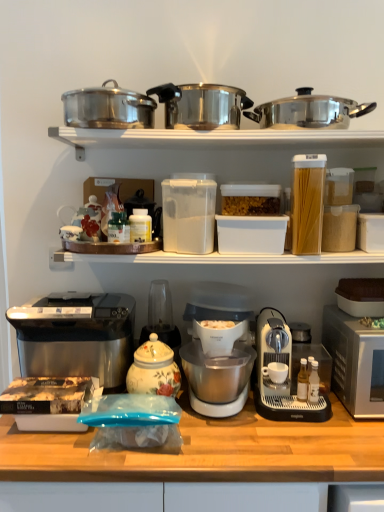
Where is `free space in front of white plastic coffee maker at center, arranged as the 2th coffee maker when viewed from the right`? free space in front of white plastic coffee maker at center, arranged as the 2th coffee maker when viewed from the right is located at coordinates (242, 448).